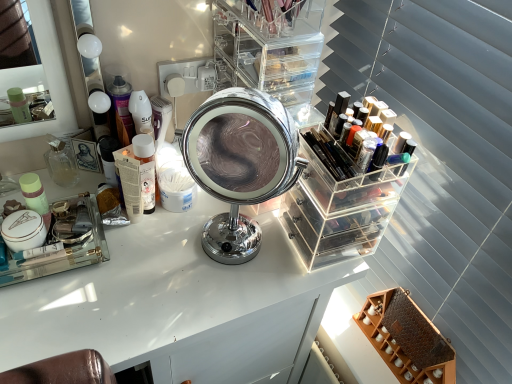
Identify the location of vacant space underneath chrome/metallic mirror at center (from a real-world perspective). (237, 257).